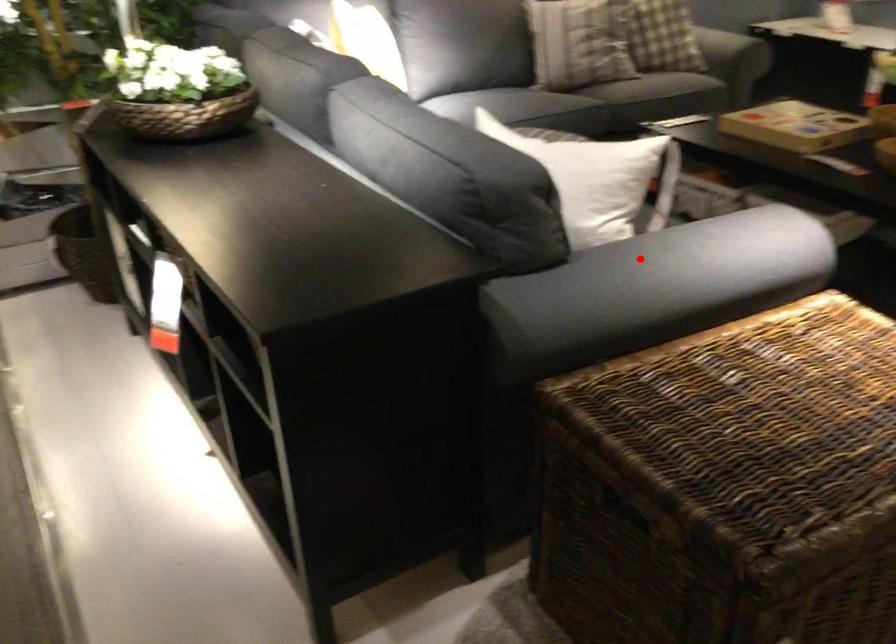
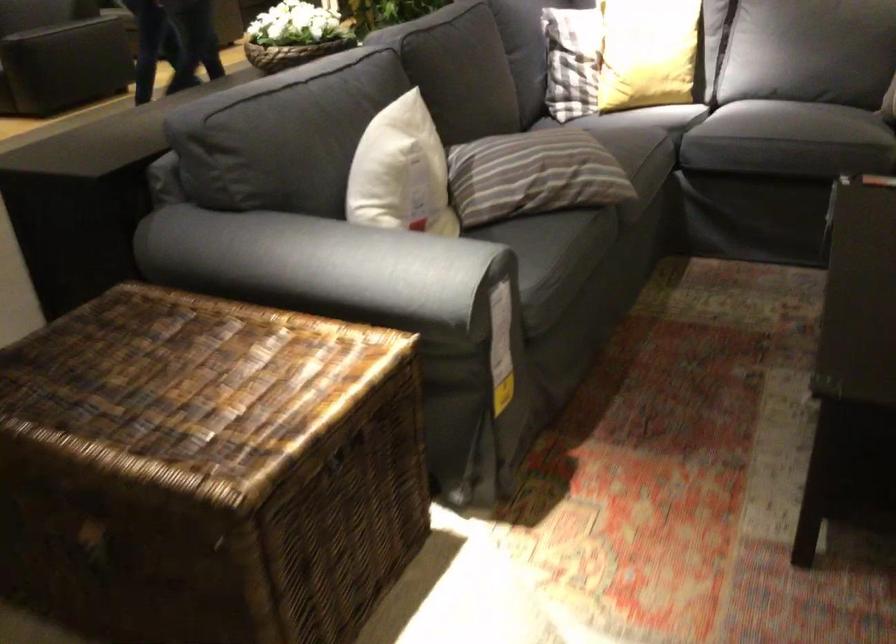
Find the pixel in the second image that matches the highlighted location in the first image.

(304, 265)